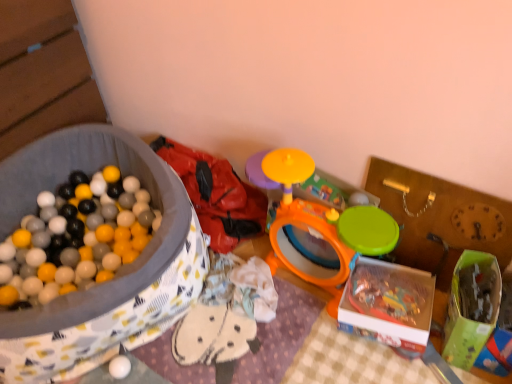
Where is `spots to the right of white matte ball at lower left, the 1th toy in the left-to-right sequence`? The image size is (512, 384). spots to the right of white matte ball at lower left, the 1th toy in the left-to-right sequence is located at coordinates (166, 358).